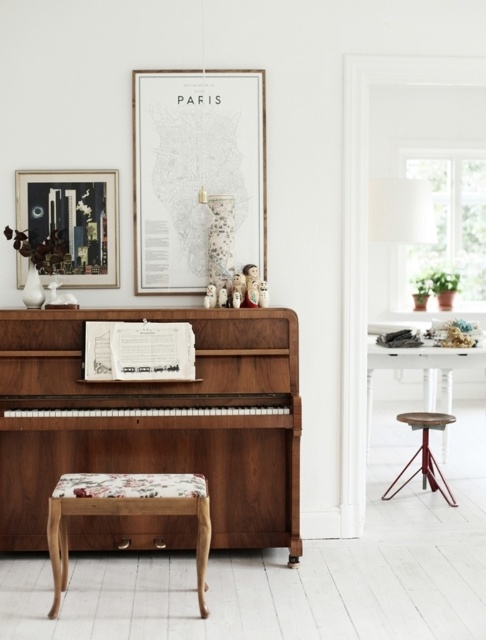
Which is more to the right, shiny walnut piano at center or floral fabric stool at lower center?

Positioned to the right is shiny walnut piano at center.

Is shiny walnut piano at center to the right of floral fabric stool at lower center from the viewer's perspective?

Correct, you'll find shiny walnut piano at center to the right of floral fabric stool at lower center.

The height and width of the screenshot is (640, 486). I want to click on shiny walnut piano at center, so click(x=156, y=420).

I want to click on shiny walnut piano at center, so click(156, 420).

Which is in front, point (138, 138) or point (208, 500)?

Point (208, 500) is in front.

Does point (162, 157) come in front of point (126, 493)?

That is False.

Who is more distant from viewer, (161, 202) or (126, 484)?

Point (161, 202)

I want to click on wooden picture frame at upper center, so click(x=195, y=172).

Who is more forward, (67, 452) or (23, 195)?

Point (67, 452) is more forward.

Is point (53, 320) farther from camera compared to point (34, 234)?

No, it is in front of (34, 234).

Where is `shiny walnut piano at center`? shiny walnut piano at center is located at coordinates (156, 420).